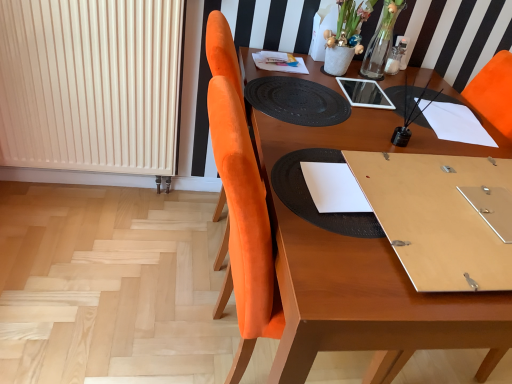
Question: Is black textured placemat at center wider or thinner than black textured placemat at center?

Choices:
 (A) thin
 (B) wide

Answer: (B)

Question: Considering their positions, is black textured placemat at center located in front of or behind black textured placemat at center?

Choices:
 (A) behind
 (B) front

Answer: (A)

Question: Estimate the real-world distances between objects in this image. Which object is closer to the white matte vase at upper center?

Choices:
 (A) black textured placemat at center
 (B) black textured placemat at center
 (C) white paper at center
 (D) wooden table at center
 (E) white ribbed radiator at left

Answer: (B)

Question: Which object is the farthest from the black textured placemat at center?

Choices:
 (A) white ribbed radiator at left
 (B) black textured placemat at center
 (C) wooden table at center
 (D) white paper at center
 (E) white matte vase at upper center

Answer: (A)